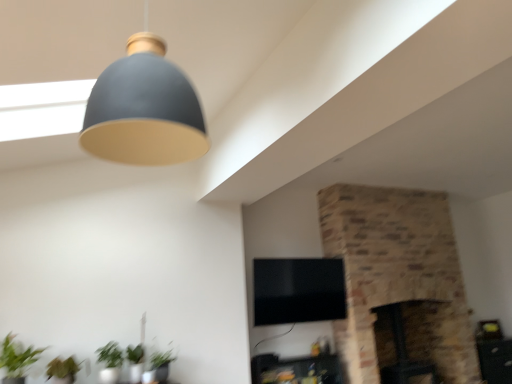
Question: From their relative heights in the image, would you say green matte plant at lower left is taller or shorter than brick fireplace at center, acting as the 1th fireplace starting from the right?

Choices:
 (A) short
 (B) tall

Answer: (A)

Question: Is point (35, 352) closer or farther from the camera than point (399, 264)?

Choices:
 (A) closer
 (B) farther

Answer: (A)

Question: Estimate the real-world distances between objects in this image. Which object is closer to the matte black tv stand at lower center, which appears as the first furniture when viewed from the left?

Choices:
 (A) green matte plant at lower left
 (B) green leafy plant at lower left, acting as the first plant starting from the left
 (C) matte gray lampshade at upper center
 (D) green matte plant at lower left, which ranks as the first plant in right-to-left order
 (E) dark brown stone fireplace at center-right, acting as the 2th fireplace starting from the right

Answer: (E)

Question: Considering the real-world distances, which object is closest to the matte black tv stand at lower center, which is the 2th furniture from back to front?

Choices:
 (A) wooden side table at lower right, placed as the 2th furniture when sorted from left to right
 (B) green matte plant at lower left, which ranks as the first plant in right-to-left order
 (C) matte gray lampshade at upper center
 (D) green leafy plant at lower left, which is the 2th plant from right to left
 (E) brick fireplace at center, which is the second fireplace from left to right

Answer: (E)